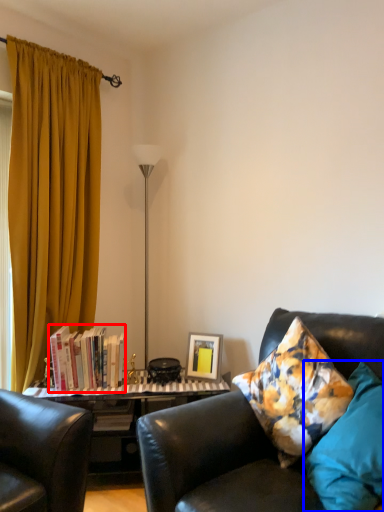
Question: Which object appears farthest to the camera in this image, book (highlighted by a red box) or pillow (highlighted by a blue box)?

Choices:
 (A) book
 (B) pillow

Answer: (A)